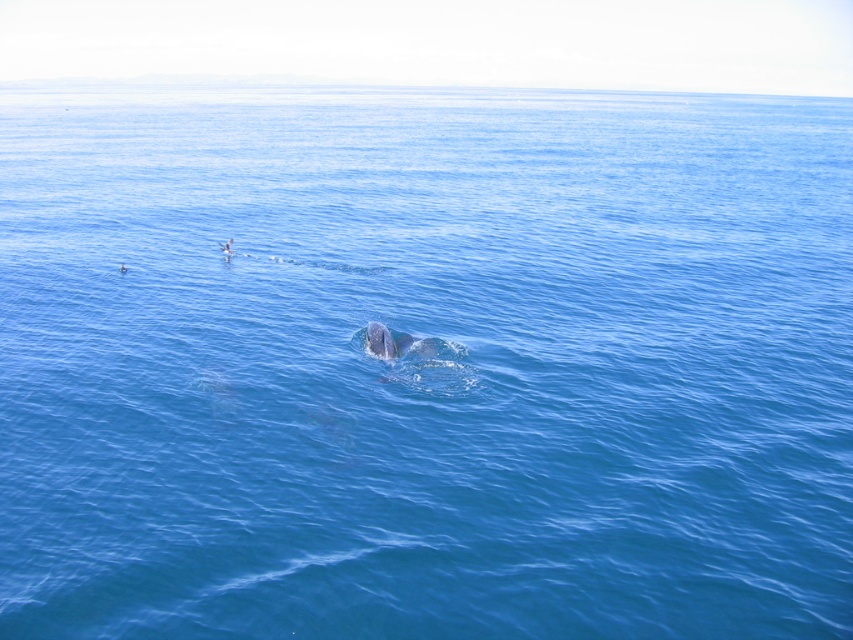
You are a photographer standing on a boat and want to capture both the gray matte whale at center and the smooth skin person at upper left in the same frame. Which object should you focus on first to ensure they are both in focus?

The gray matte whale at center is taller than the smooth skin person at upper left, so you should focus on the gray matte whale at center first to ensure both are in focus.

You are on a boat in the ocean and see the gray matte whale at center and the smooth skin person at upper left. Which one appears bigger in the scene?

The gray matte whale at center appears bigger than the smooth skin person at upper left because it has a larger size compared to the smooth skin person at upper left.

You are a marine biologist observing the ocean scene. You notice a point labeled at coordinates (386,340). What object in the scene is located at that point?

The point at coordinates (386,340) corresponds to the gray matte whale at center.